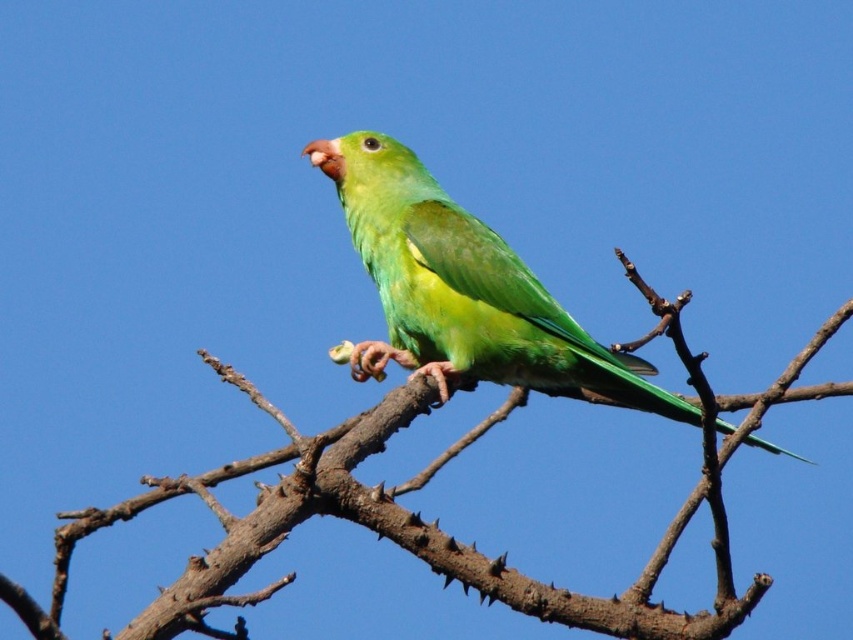
Question: Does brown rough branch at center come behind green matte parrot at center?

Choices:
 (A) no
 (B) yes

Answer: (A)

Question: Observing the image, what is the correct spatial positioning of brown rough branch at center in reference to green matte parrot at center?

Choices:
 (A) above
 (B) below

Answer: (B)

Question: Which point appears closest to the camera in this image?

Choices:
 (A) (59, 579)
 (B) (444, 244)

Answer: (A)

Question: Can you confirm if brown rough branch at center is positioned to the left of green matte parrot at center?

Choices:
 (A) yes
 (B) no

Answer: (A)